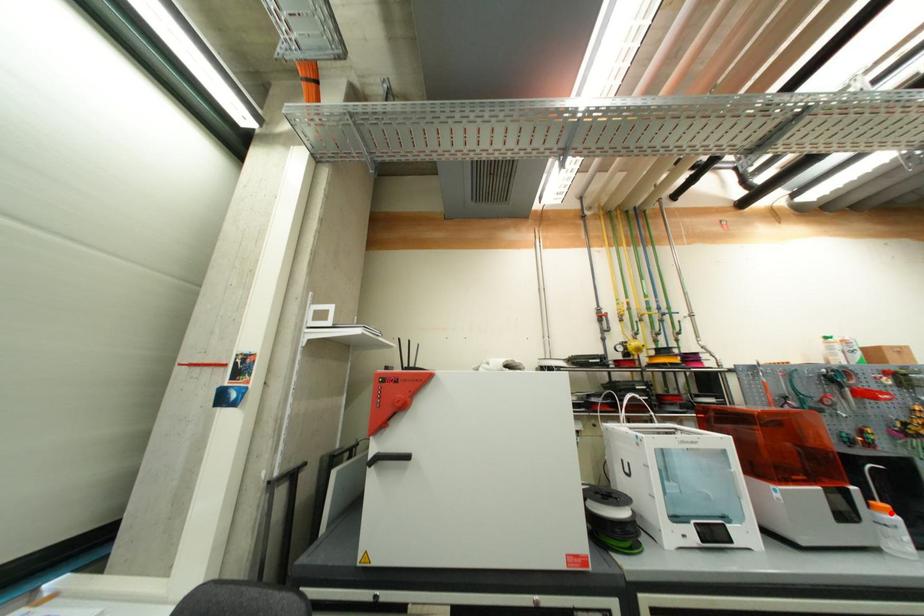
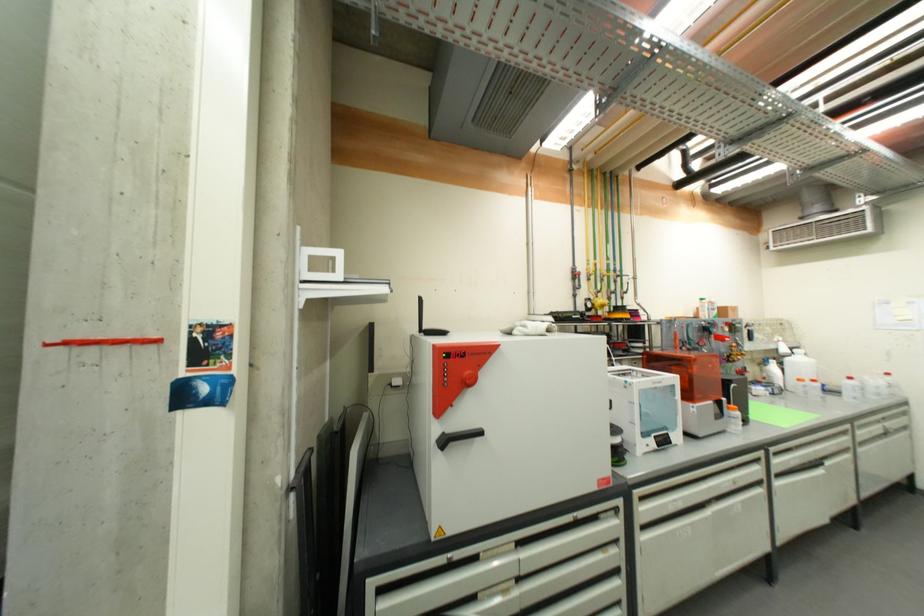
Question: A red point is marked in image1. In image2, is the corresponding 3D point closer to the camera or farther? Reply with the corresponding letter.

Choices:
 (A) The corresponding 3D point is closer.
 (B) The corresponding 3D point is farther.

Answer: (B)